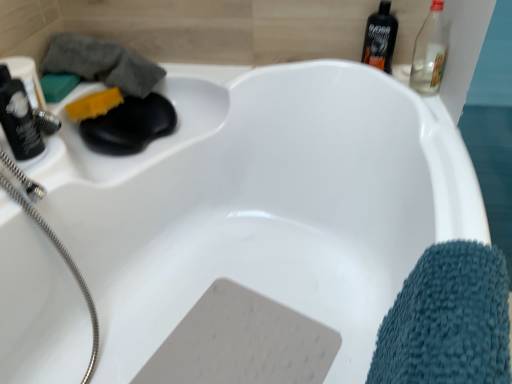
Question: From a real-world perspective, is green matte soap at upper left, the 2th soap from the right, beneath matte black shaver at left, acting as the first bottle starting from the left?

Choices:
 (A) no
 (B) yes

Answer: (B)

Question: Is matte black shaver at left, acting as the 2th bottle starting from the top, a part of green matte soap at upper left, which ranks as the 1th soap in left-to-right order?

Choices:
 (A) yes
 (B) no

Answer: (B)

Question: Considering the relative positions of green matte soap at upper left, the 2th soap from the right, and matte black shaver at left, arranged as the 1th bottle when viewed from the front, in the image provided, is green matte soap at upper left, the 2th soap from the right, to the right of matte black shaver at left, arranged as the 1th bottle when viewed from the front, from the viewer's perspective?

Choices:
 (A) no
 (B) yes

Answer: (A)

Question: Is green matte soap at upper left, the 2th soap from the right, taller than matte black shaver at left, the second bottle from the back?

Choices:
 (A) yes
 (B) no

Answer: (B)

Question: From the image's perspective, is green matte soap at upper left, the 2th soap from the right, located above matte black shaver at left, acting as the 2th bottle starting from the top?

Choices:
 (A) no
 (B) yes

Answer: (B)

Question: Would you say teal microfiber towel at lower right, acting as the first bath towel starting from the front, is to the left or to the right of green matte soap at upper left, which ranks as the 1th soap in left-to-right order, in the picture?

Choices:
 (A) right
 (B) left

Answer: (A)

Question: Would you say teal microfiber towel at lower right, marked as the second bath towel in a back-to-front arrangement, is inside or outside green matte soap at upper left, which ranks as the 1th soap in left-to-right order?

Choices:
 (A) outside
 (B) inside

Answer: (A)

Question: From the image's perspective, is teal microfiber towel at lower right, which is the first bath towel in right-to-left order, above or below green matte soap at upper left, the 2th soap from the right?

Choices:
 (A) below
 (B) above

Answer: (A)

Question: In the image, is teal microfiber towel at lower right, which is the first bath towel in right-to-left order, positioned in front of or behind green matte soap at upper left, the 2th soap from the right?

Choices:
 (A) front
 (B) behind

Answer: (A)

Question: Is clear glass bottle at upper right, acting as the 1th bottle starting from the back, inside the boundaries of green matte soap at upper left, the 2th soap from the right, or outside?

Choices:
 (A) outside
 (B) inside

Answer: (A)

Question: In terms of width, does clear glass bottle at upper right, arranged as the 1th bottle when viewed from the right, look wider or thinner when compared to green matte soap at upper left, which ranks as the 1th soap in left-to-right order?

Choices:
 (A) thin
 (B) wide

Answer: (A)

Question: Is point pos(439,28) closer or farther from the camera than point pos(46,99)?

Choices:
 (A) closer
 (B) farther

Answer: (B)

Question: From the image's perspective, is clear glass bottle at upper right, which is the 1th bottle from top to bottom, located above or below green matte soap at upper left, which ranks as the 1th soap in left-to-right order?

Choices:
 (A) below
 (B) above

Answer: (B)

Question: Would you say black plastic bottle at upper right is to the left or to the right of gray terry cloth towel at upper left, positioned as the 2th bath towel in right-to-left order, in the picture?

Choices:
 (A) right
 (B) left

Answer: (A)

Question: Considering the positions of black plastic bottle at upper right and gray terry cloth towel at upper left, the 1th bath towel positioned from the top, in the image, is black plastic bottle at upper right wider or thinner than gray terry cloth towel at upper left, the 1th bath towel positioned from the top,?

Choices:
 (A) wide
 (B) thin

Answer: (B)